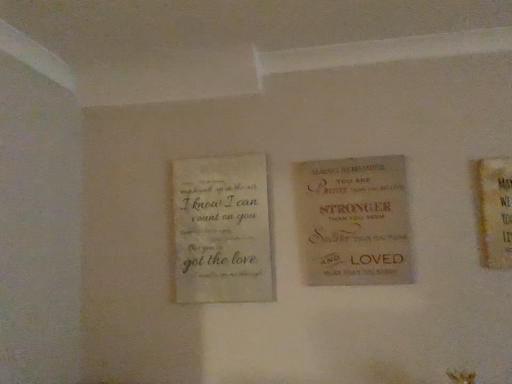
Question: Considering the positions of beige textured canvas sign at center, the second book from the left, and off-white textured paper at left, the second book positioned from the right, in the image, is beige textured canvas sign at center, the second book from the left, taller or shorter than off-white textured paper at left, the second book positioned from the right,?

Choices:
 (A) short
 (B) tall

Answer: (A)

Question: From the image's perspective, is beige textured canvas sign at center, the second book from the left, above or below off-white textured paper at left, the second book positioned from the right?

Choices:
 (A) below
 (B) above

Answer: (B)

Question: Considering the positions of beige textured canvas sign at center, placed as the first book when sorted from right to left, and off-white textured paper at left, the second book positioned from the right, in the image, is beige textured canvas sign at center, placed as the first book when sorted from right to left, wider or thinner than off-white textured paper at left, the second book positioned from the right,?

Choices:
 (A) wide
 (B) thin

Answer: (A)

Question: Is off-white textured paper at left, placed as the 1th book when sorted from left to right, situated inside beige textured canvas sign at center, the second book from the left, or outside?

Choices:
 (A) inside
 (B) outside

Answer: (B)

Question: Considering their positions, is off-white textured paper at left, the second book positioned from the right, located in front of or behind beige textured canvas sign at center, placed as the first book when sorted from right to left?

Choices:
 (A) front
 (B) behind

Answer: (B)

Question: Is point (184, 165) closer or farther from the camera than point (308, 208)?

Choices:
 (A) closer
 (B) farther

Answer: (B)

Question: In terms of width, does off-white textured paper at left, placed as the 1th book when sorted from left to right, look wider or thinner when compared to beige textured canvas sign at center, the second book from the left?

Choices:
 (A) thin
 (B) wide

Answer: (A)